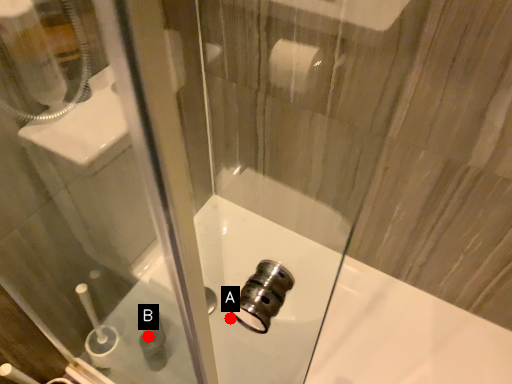
Question: Two points are circled on the image, labeled by A and B beside each circle. Which point appears farthest from the camera in this image?

Choices:
 (A) A is further
 (B) B is further

Answer: (A)